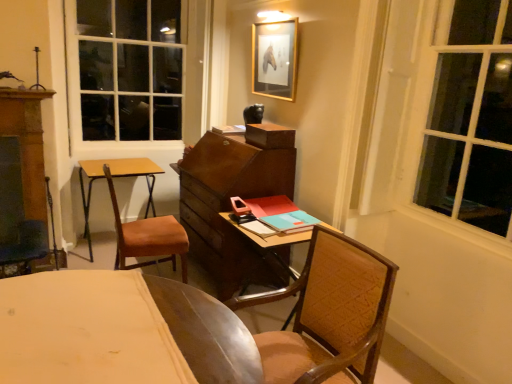
Question: Can you confirm if brown wooden dresser at left is wider than gold-framed picture at upper center?

Choices:
 (A) no
 (B) yes

Answer: (B)

Question: Considering the relative sizes of brown wooden dresser at left and gold-framed picture at upper center in the image provided, is brown wooden dresser at left bigger than gold-framed picture at upper center?

Choices:
 (A) no
 (B) yes

Answer: (B)

Question: Is gold-framed picture at upper center a part of brown wooden dresser at left?

Choices:
 (A) yes
 (B) no

Answer: (B)

Question: Would you say brown wooden dresser at left is a long distance from gold-framed picture at upper center?

Choices:
 (A) no
 (B) yes

Answer: (B)

Question: From a real-world perspective, is brown wooden dresser at left below gold-framed picture at upper center?

Choices:
 (A) no
 (B) yes

Answer: (B)

Question: Does brown wooden dresser at left have a lesser width compared to gold-framed picture at upper center?

Choices:
 (A) yes
 (B) no

Answer: (B)

Question: Is gold-framed picture at upper center inside brown woven chair at center, which is counted as the 1th chair, starting from the right?

Choices:
 (A) yes
 (B) no

Answer: (B)

Question: From a real-world perspective, is brown woven chair at center, which appears as the first chair when viewed from the front, physically below gold-framed picture at upper center?

Choices:
 (A) yes
 (B) no

Answer: (A)

Question: Considering the relative sizes of brown woven chair at center, marked as the second chair in a left-to-right arrangement, and gold-framed picture at upper center in the image provided, is brown woven chair at center, marked as the second chair in a left-to-right arrangement, shorter than gold-framed picture at upper center?

Choices:
 (A) no
 (B) yes

Answer: (A)

Question: Are brown woven chair at center, which is counted as the 1th chair, starting from the right, and gold-framed picture at upper center making contact?

Choices:
 (A) yes
 (B) no

Answer: (B)

Question: Could you tell me if brown woven chair at center, which appears as the 2th chair when viewed from the back, is facing gold-framed picture at upper center?

Choices:
 (A) yes
 (B) no

Answer: (B)

Question: Considering the relative sizes of brown woven chair at center, which appears as the 2th chair when viewed from the back, and gold-framed picture at upper center in the image provided, is brown woven chair at center, which appears as the 2th chair when viewed from the back, taller than gold-framed picture at upper center?

Choices:
 (A) yes
 (B) no

Answer: (A)

Question: Does gold-framed picture at upper center have a smaller size compared to brown woven chair at center, which appears as the 2th chair when viewed from the back?

Choices:
 (A) no
 (B) yes

Answer: (B)